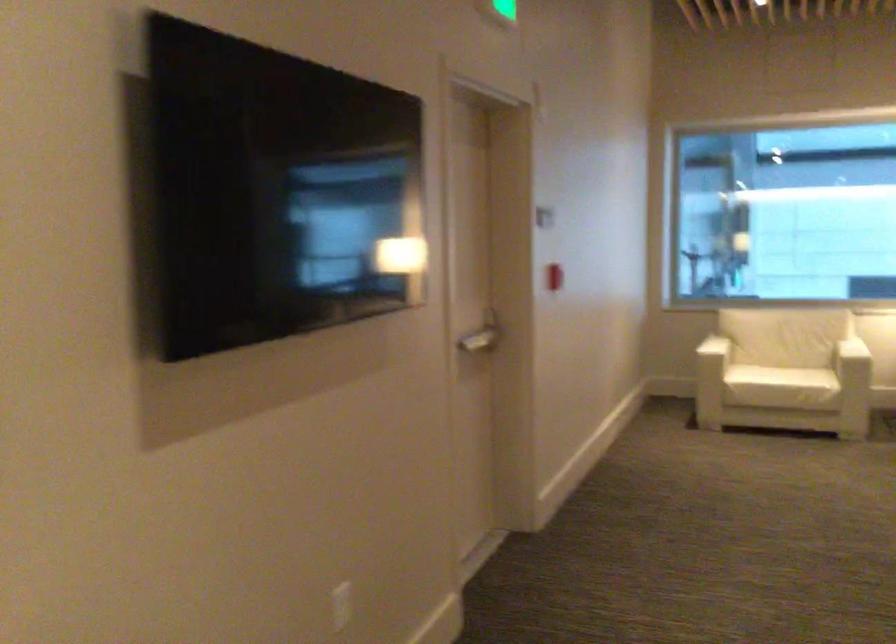
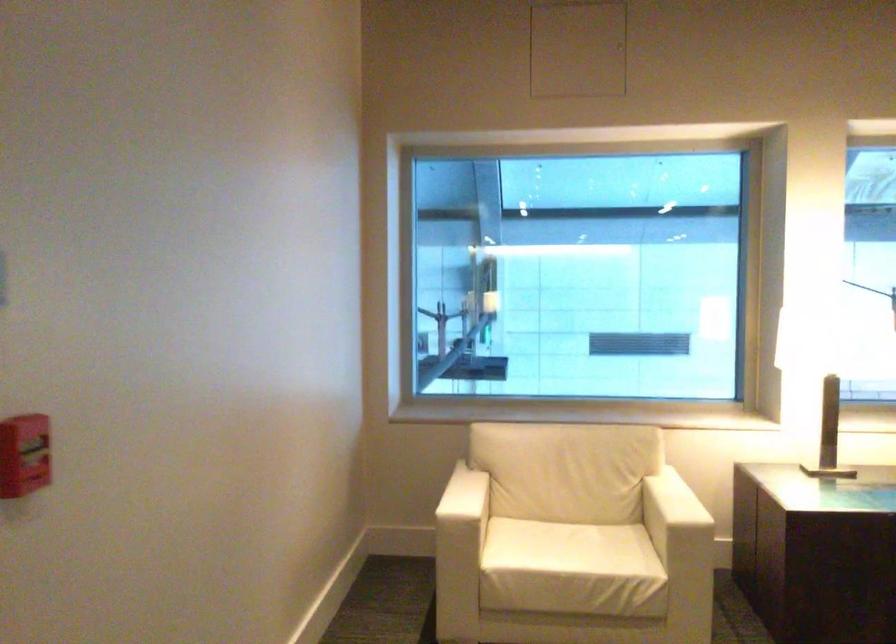
Find the pixel in the second image that matches (721,334) in the first image.

(462, 498)